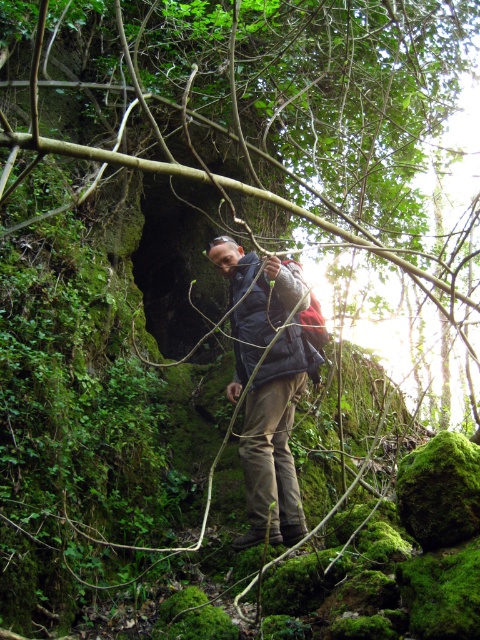
Who is more distant from viewer, (298,266) or (295,280)?

Point (298,266)

Can you confirm if dark blue jacket at center is thinner than dark blue fabric jacket at center?

No.

Between point (233, 253) and point (272, 324), which one is positioned behind?

The point (233, 253) is behind.

The height and width of the screenshot is (640, 480). In order to click on dark blue jacket at center in this screenshot , I will do `click(275, 438)`.

Does green mossy rock at center have a greater height compared to dark blue fabric jacket at center?

Yes.

Which is in front, point (148, 228) or point (239, 272)?

Point (239, 272) is more forward.

Locate an element on the screen. Image resolution: width=480 pixels, height=640 pixels. green mossy rock at center is located at coordinates (236, 132).

Can you confirm if green mossy rock at center is positioned above dark blue jacket at center?

Indeed, green mossy rock at center is positioned over dark blue jacket at center.

Between point (447, 262) and point (290, 401), which one is positioned behind?

Positioned behind is point (447, 262).

Is point (407, 150) positioned in front of point (243, 348)?

No, it is not.

Locate an element on the screen. The height and width of the screenshot is (640, 480). green mossy rock at center is located at coordinates (236, 132).